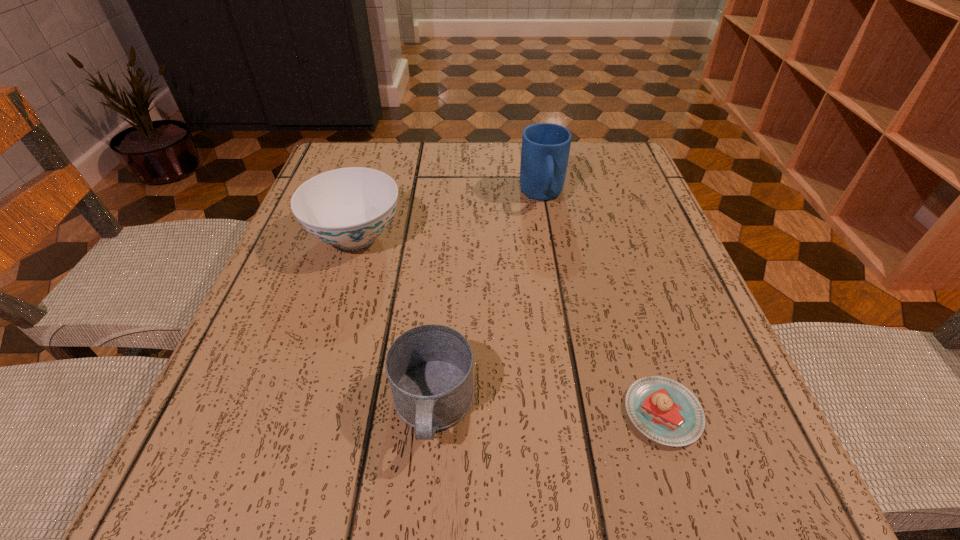
Locate an element on the screen. The width and height of the screenshot is (960, 540). free region at the far left corner of the desktop is located at coordinates (348, 162).

Identify the location of free space that is in between the chinaware and the pastry. (509, 324).

Image resolution: width=960 pixels, height=540 pixels. I want to click on unoccupied position between the rightmost object and the right mug, so click(602, 304).

Image resolution: width=960 pixels, height=540 pixels. I want to click on vacant space that's between the taller mug and the leftmost object, so [448, 216].

The image size is (960, 540). What are the coordinates of `free space between the leftmost object and the shorter mug` in the screenshot? It's located at (395, 322).

Locate an element on the screen. This screenshot has height=540, width=960. vacant space in between the second object from right to left and the nearer mug is located at coordinates [488, 301].

Find the location of `free spot between the rightmost object and the third object from right to left`. free spot between the rightmost object and the third object from right to left is located at coordinates (548, 410).

The height and width of the screenshot is (540, 960). I want to click on vacant point located between the shortest object and the leftmost object, so click(x=509, y=324).

This screenshot has width=960, height=540. Identify the location of unoccupied position between the leftmost object and the shorter mug. (395, 322).

Where is `empty location between the rightmost object and the left mug`? This screenshot has width=960, height=540. empty location between the rightmost object and the left mug is located at coordinates (548, 410).